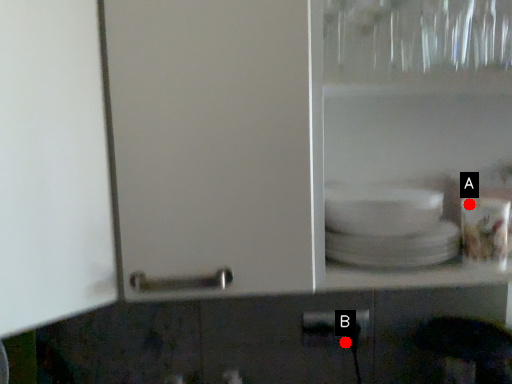
Question: Two points are circled on the image, labeled by A and B beside each circle. Which point appears closest to the camera in this image?

Choices:
 (A) A is closer
 (B) B is closer

Answer: (A)